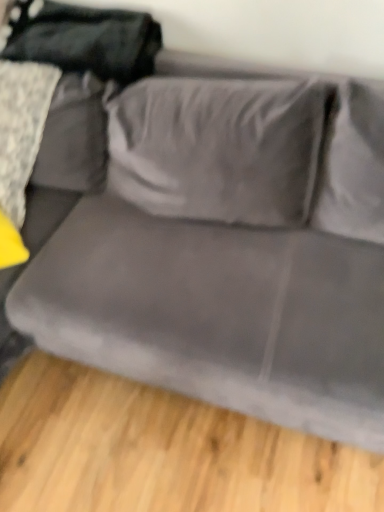
Where is `free space above gray fabric couch at lower center (from a real-world perspective)`? free space above gray fabric couch at lower center (from a real-world perspective) is located at coordinates (150, 455).